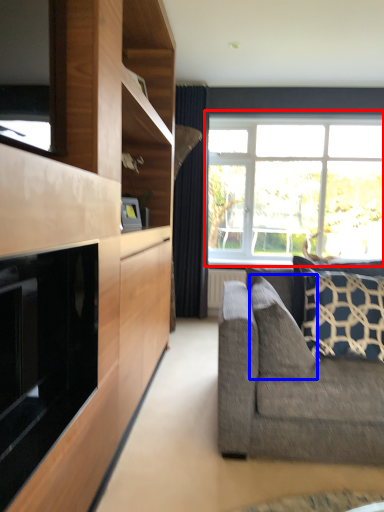
Question: Which point is further to the camera, window (highlighted by a red box) or pillow (highlighted by a blue box)?

Choices:
 (A) window
 (B) pillow

Answer: (A)